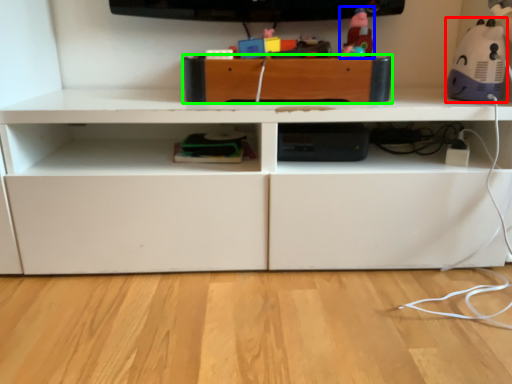
Question: Which object is positioned farthest from toy (highlighted by a red box)? Select from toy (highlighted by a blue box) and drawer (highlighted by a green box).

Choices:
 (A) toy
 (B) drawer

Answer: (B)